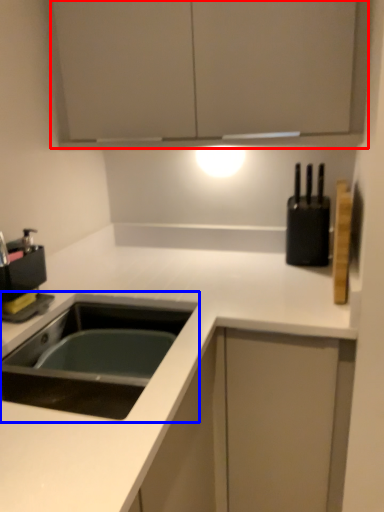
Question: Which point is further to the camera, cabinetry (highlighted by a red box) or sink (highlighted by a blue box)?

Choices:
 (A) cabinetry
 (B) sink

Answer: (A)